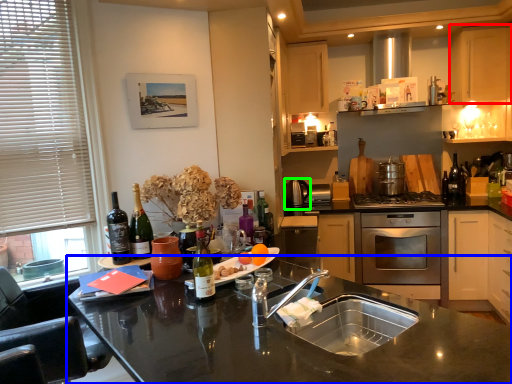
Question: Based on their relative distances, which object is farther from cabinetry (highlighted by a red box)? Choose from countertop (highlighted by a blue box) and appliance (highlighted by a green box).

Choices:
 (A) countertop
 (B) appliance

Answer: (A)